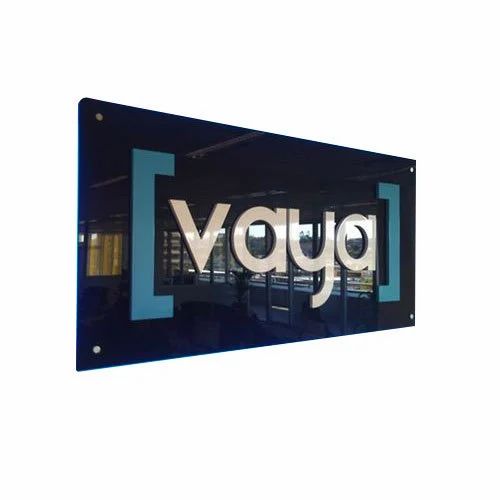
Locate an element on the screen. This screenshot has width=500, height=500. plant vase is located at coordinates tap(242, 308).